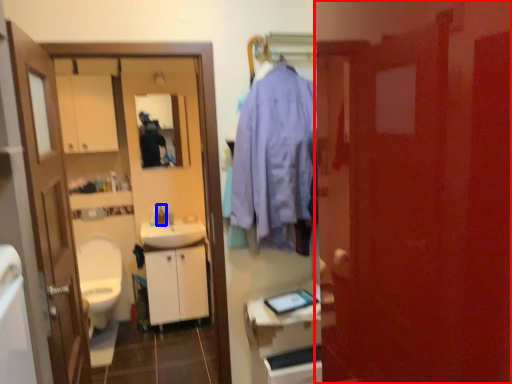
Question: Among these objects, which one is farthest to the camera, door (highlighted by a red box) or toiletry (highlighted by a blue box)?

Choices:
 (A) door
 (B) toiletry

Answer: (B)